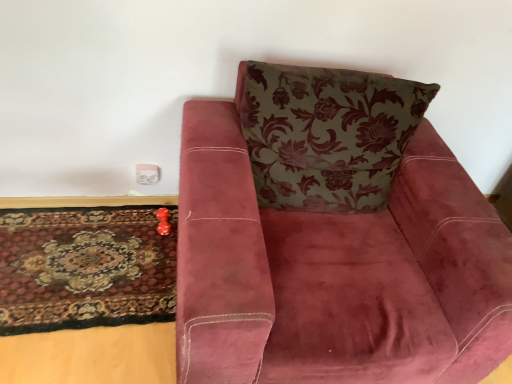
Question: Does carpeted rug at lower left have a lesser width compared to white plastic electric outlet at lower left?

Choices:
 (A) no
 (B) yes

Answer: (A)

Question: From a real-world perspective, is carpeted rug at lower left under white plastic electric outlet at lower left?

Choices:
 (A) yes
 (B) no

Answer: (A)

Question: Does carpeted rug at lower left come behind white plastic electric outlet at lower left?

Choices:
 (A) yes
 (B) no

Answer: (B)

Question: Is carpeted rug at lower left not near white plastic electric outlet at lower left?

Choices:
 (A) yes
 (B) no

Answer: (B)

Question: Could you tell me if carpeted rug at lower left is facing white plastic electric outlet at lower left?

Choices:
 (A) no
 (B) yes

Answer: (A)

Question: From a real-world perspective, is carpeted rug at lower left positioned above or below velvet maroon armchair at center?

Choices:
 (A) above
 (B) below

Answer: (B)

Question: In terms of height, does carpeted rug at lower left look taller or shorter compared to velvet maroon armchair at center?

Choices:
 (A) tall
 (B) short

Answer: (B)

Question: Considering the positions of carpeted rug at lower left and velvet maroon armchair at center in the image, is carpeted rug at lower left wider or thinner than velvet maroon armchair at center?

Choices:
 (A) thin
 (B) wide

Answer: (A)

Question: Visually, is carpeted rug at lower left positioned to the left or to the right of velvet maroon armchair at center?

Choices:
 (A) left
 (B) right

Answer: (A)

Question: In terms of height, does velvet maroon armchair at center look taller or shorter compared to carpeted rug at lower left?

Choices:
 (A) short
 (B) tall

Answer: (B)

Question: Choose the correct answer: Is velvet maroon armchair at center inside carpeted rug at lower left or outside it?

Choices:
 (A) inside
 (B) outside

Answer: (B)

Question: From a real-world perspective, relative to carpeted rug at lower left, is velvet maroon armchair at center vertically above or below?

Choices:
 (A) below
 (B) above

Answer: (B)

Question: In the image, is velvet maroon armchair at center positioned in front of or behind carpeted rug at lower left?

Choices:
 (A) front
 (B) behind

Answer: (A)

Question: Looking at the image, does white plastic electric outlet at lower left seem bigger or smaller compared to floral-patterned fabric pillow at upper center?

Choices:
 (A) small
 (B) big

Answer: (A)

Question: Is white plastic electric outlet at lower left taller or shorter than floral-patterned fabric pillow at upper center?

Choices:
 (A) tall
 (B) short

Answer: (B)